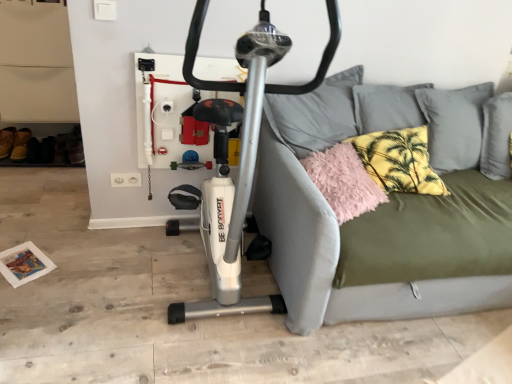
Identify the location of unoccupied area in front of silver metallic stationary bicycle at center. (175, 356).